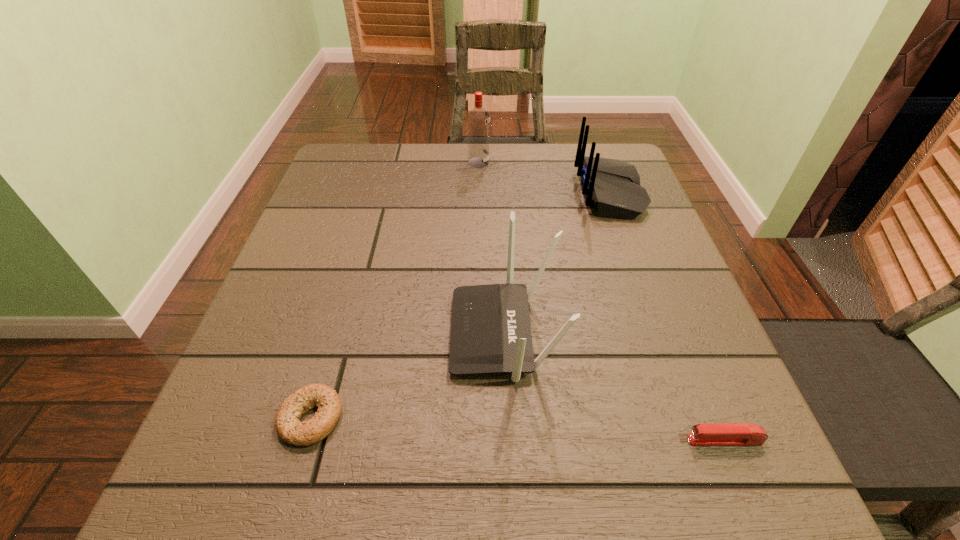
Locate an element on the screen. The height and width of the screenshot is (540, 960). router that is at the right edge is located at coordinates (612, 186).

Locate an element on the screen. stapler that is at the right edge is located at coordinates (727, 434).

Identify the location of object that is at the far right corner. Image resolution: width=960 pixels, height=540 pixels. (612, 186).

In the image, there is a desktop. Where is `vacant region at the far edge`? The width and height of the screenshot is (960, 540). vacant region at the far edge is located at coordinates (543, 164).

Find the location of `free spot at the near edge of the desktop`. free spot at the near edge of the desktop is located at coordinates (313, 476).

Locate an element on the screen. free space at the left edge of the desktop is located at coordinates (239, 395).

The image size is (960, 540). In the image, there is a desktop. In order to click on vacant region at the right edge in this screenshot , I will do `click(651, 426)`.

Find the location of `free space at the far left corner`. free space at the far left corner is located at coordinates (338, 181).

This screenshot has width=960, height=540. What are the coordinates of `vacant space at the near left corner` in the screenshot? It's located at (200, 484).

Image resolution: width=960 pixels, height=540 pixels. Identify the location of vacant area between the fourth tallest object and the bagel. (517, 429).